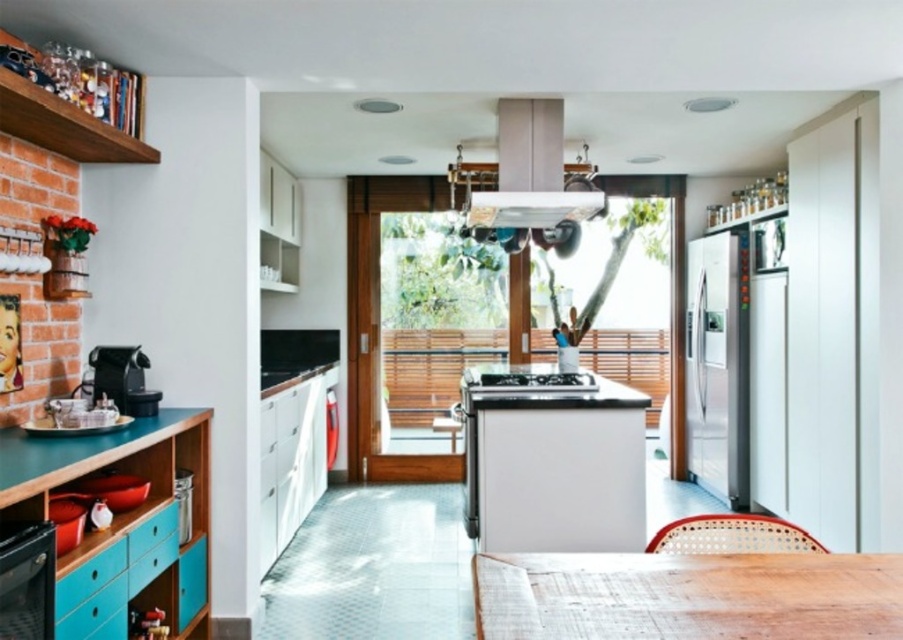
You are a chef standing in the kitchen and want to reach both the matte gray exhaust hood at upper center and the black glass oven at lower left. Which one will you need to stretch your arm further to reach?

The black glass oven at lower left requires stretching further because it is closer to you than the matte gray exhaust hood at upper center, which is farther away.

You are standing at the camera position in the kitchen. There is a matte gray exhaust hood at upper center that you need to clean. Can you reach it without moving your position? Please explain your reasoning.

The matte gray exhaust hood at upper center is 10.56 feet away from the camera. Since this distance is quite far, it would be difficult to reach the exhaust hood without moving closer. Therefore, you would need to move closer to clean it effectively.